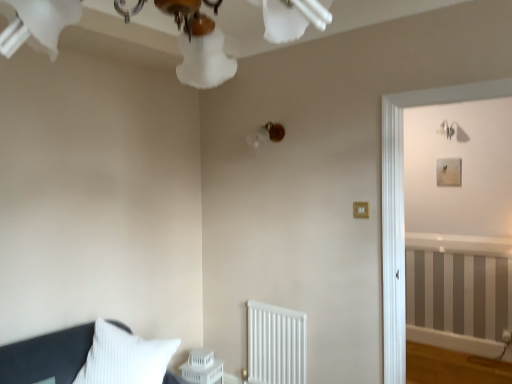
Question: From a real-world perspective, does matte brown lampshade at upper center stand above white plastic table at lower center?

Choices:
 (A) yes
 (B) no

Answer: (A)

Question: Is matte brown lampshade at upper center wider than white plastic table at lower center?

Choices:
 (A) no
 (B) yes

Answer: (B)

Question: From a real-world perspective, is matte brown lampshade at upper center located beneath white plastic table at lower center?

Choices:
 (A) yes
 (B) no

Answer: (B)

Question: Is white plastic table at lower center at the back of matte brown lampshade at upper center?

Choices:
 (A) yes
 (B) no

Answer: (B)

Question: Is white plastic table at lower center inside matte brown lampshade at upper center?

Choices:
 (A) no
 (B) yes

Answer: (A)

Question: Considering their positions, is white plastic table at lower center located in front of or behind gold metallic light switch at center-right?

Choices:
 (A) front
 (B) behind

Answer: (B)

Question: Do you think white plastic table at lower center is within gold metallic light switch at center-right, or outside of it?

Choices:
 (A) inside
 (B) outside

Answer: (B)

Question: Is white plastic table at lower center bigger or smaller than gold metallic light switch at center-right?

Choices:
 (A) small
 (B) big

Answer: (B)

Question: In terms of width, does white plastic table at lower center look wider or thinner when compared to gold metallic light switch at center-right?

Choices:
 (A) thin
 (B) wide

Answer: (B)

Question: Is white plastic table at lower center taller or shorter than white matte radiator at lower center?

Choices:
 (A) tall
 (B) short

Answer: (B)

Question: Relative to white matte radiator at lower center, is white plastic table at lower center in front or behind?

Choices:
 (A) front
 (B) behind

Answer: (B)

Question: Is white plastic table at lower center inside the boundaries of white matte radiator at lower center, or outside?

Choices:
 (A) inside
 (B) outside

Answer: (B)

Question: From a real-world perspective, relative to white matte radiator at lower center, is white plastic table at lower center vertically above or below?

Choices:
 (A) above
 (B) below

Answer: (B)

Question: Visually, is white matte radiator at lower center positioned to the left or to the right of white frosted glass chandelier at upper center?

Choices:
 (A) right
 (B) left

Answer: (A)

Question: In terms of height, does white matte radiator at lower center look taller or shorter compared to white frosted glass chandelier at upper center?

Choices:
 (A) short
 (B) tall

Answer: (B)